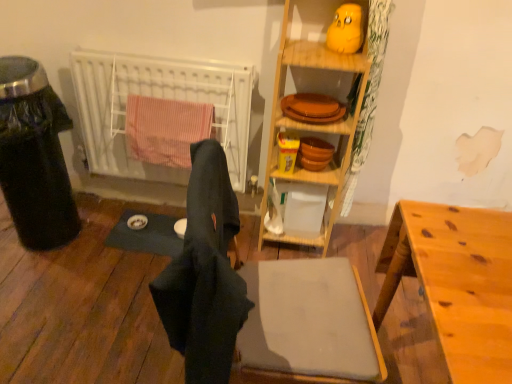
Question: Is matte orange plates at upper center taller than dark fabric laundry at center?

Choices:
 (A) no
 (B) yes

Answer: (A)

Question: Is matte orange plates at upper center outside of dark fabric laundry at center?

Choices:
 (A) yes
 (B) no

Answer: (A)

Question: Is matte orange plates at upper center to the left of dark fabric laundry at center from the viewer's perspective?

Choices:
 (A) no
 (B) yes

Answer: (A)

Question: Is matte orange plates at upper center positioned with its back to dark fabric laundry at center?

Choices:
 (A) yes
 (B) no

Answer: (B)

Question: Is matte orange plates at upper center not near dark fabric laundry at center?

Choices:
 (A) yes
 (B) no

Answer: (B)

Question: Considering the positions of light brown wooden desk at lower right and yellow matte rubber duck at upper center in the image, is light brown wooden desk at lower right wider or thinner than yellow matte rubber duck at upper center?

Choices:
 (A) thin
 (B) wide

Answer: (B)

Question: Looking at the image, does light brown wooden desk at lower right seem bigger or smaller compared to yellow matte rubber duck at upper center?

Choices:
 (A) small
 (B) big

Answer: (B)

Question: Is point (454, 297) closer or farther from the camera than point (351, 13)?

Choices:
 (A) farther
 (B) closer

Answer: (B)

Question: From the image's perspective, is light brown wooden desk at lower right positioned above or below yellow matte rubber duck at upper center?

Choices:
 (A) above
 (B) below

Answer: (B)

Question: From their relative heights in the image, would you say white matte radiator at left is taller or shorter than transparent plastic trash can at left?

Choices:
 (A) short
 (B) tall

Answer: (A)

Question: Looking at their shapes, would you say white matte radiator at left is wider or thinner than transparent plastic trash can at left?

Choices:
 (A) thin
 (B) wide

Answer: (A)

Question: From the image's perspective, is white matte radiator at left positioned above or below transparent plastic trash can at left?

Choices:
 (A) above
 (B) below

Answer: (A)

Question: From a real-world perspective, relative to transparent plastic trash can at left, is white matte radiator at left vertically above or below?

Choices:
 (A) above
 (B) below

Answer: (A)

Question: Is white matte radiator at left wider or thinner than wooden shelf at upper center?

Choices:
 (A) thin
 (B) wide

Answer: (A)

Question: Considering their positions, is white matte radiator at left located in front of or behind wooden shelf at upper center?

Choices:
 (A) front
 (B) behind

Answer: (B)